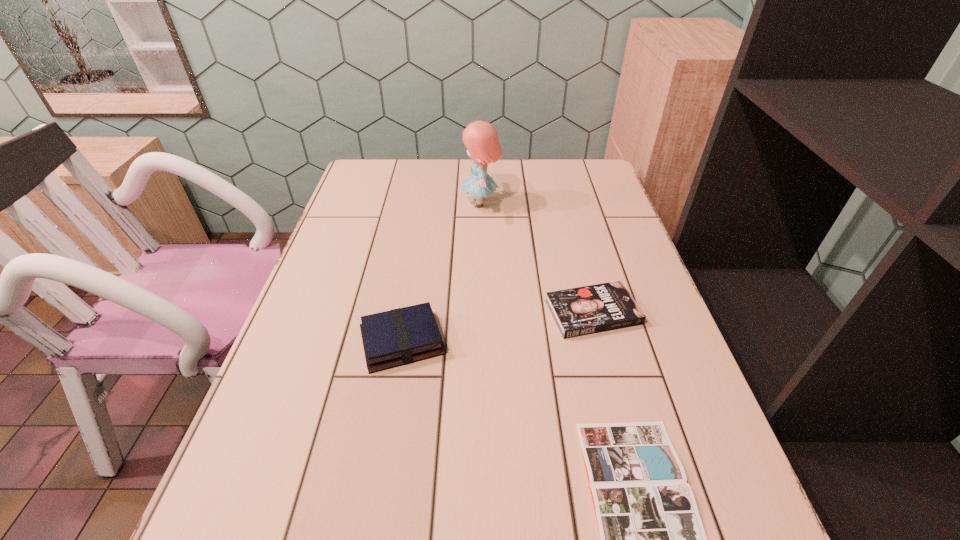
The width and height of the screenshot is (960, 540). I want to click on free area in between the second tallest object and the second tallest book, so click(x=497, y=327).

Where is `vacant area between the leftmost book and the second tallest book`? vacant area between the leftmost book and the second tallest book is located at coordinates (497, 327).

Locate an element on the screen. object that can be found as the third closest to the doll is located at coordinates (651, 538).

You are a GUI agent. You are given a task and a screenshot of the screen. Output one action in this format:
    pyautogui.click(x=<x>, y=<y>)
    Task: Click on the object that stands as the third closest to the second tallest object
    
    Given the screenshot: What is the action you would take?
    pyautogui.click(x=481, y=139)

Find the location of a particular element. The width and height of the screenshot is (960, 540). book that can be found as the closest to the doll is located at coordinates (591, 309).

The image size is (960, 540). I want to click on book that stands as the closest to the second tallest book, so click(651, 538).

The image size is (960, 540). What are the coordinates of `free location that satisfies the following two spatial constraints: 1. on the back side of the leftmost book; 2. on the right side of the second shortest object` in the screenshot? It's located at (407, 312).

Locate an element on the screen. The height and width of the screenshot is (540, 960). vacant space that satisfies the following two spatial constraints: 1. on the front-facing side of the doll; 2. on the front side of the leftmost object is located at coordinates click(480, 341).